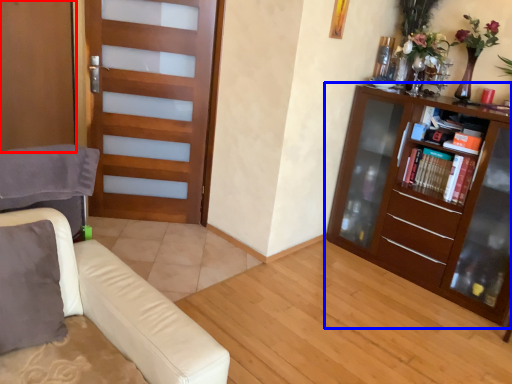
Question: Which of the following is the farthest to the observer, screen door (highlighted by a red box) or bookcase (highlighted by a blue box)?

Choices:
 (A) screen door
 (B) bookcase

Answer: (A)